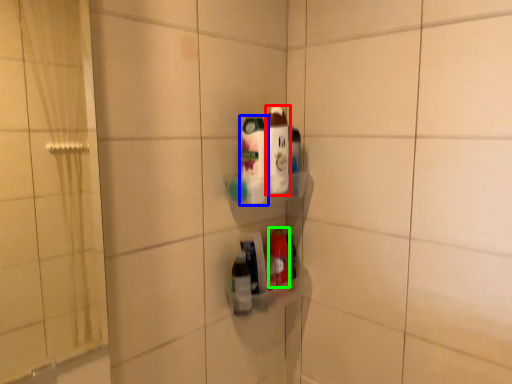
Question: Which object is positioned farthest from bottle (highlighted by a red box)? Select from bottle (highlighted by a blue box) and bottle (highlighted by a green box).

Choices:
 (A) bottle
 (B) bottle

Answer: (B)